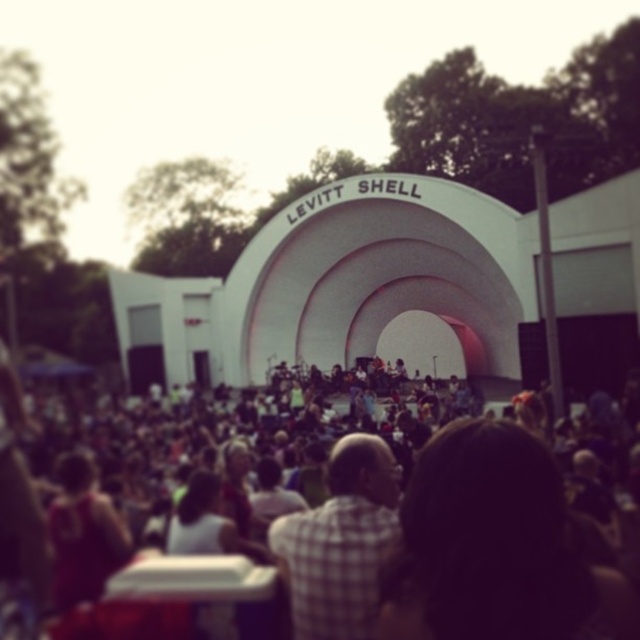
Is white smooth levitt shell at center smaller than checkered fabric shirt at center?

No, white smooth levitt shell at center is not smaller than checkered fabric shirt at center.

Which is below, white smooth levitt shell at center or checkered fabric shirt at center?

checkered fabric shirt at center is lower down.

Which is in front, point (333, 252) or point (339, 593)?

Point (339, 593) is in front.

Identify the location of white smooth levitt shell at center. (352, 291).

Is checkered fabric crowd at center thinner than white smooth levitt shell at center?

Indeed, checkered fabric crowd at center has a lesser width compared to white smooth levitt shell at center.

Can you confirm if checkered fabric crowd at center is bigger than white smooth levitt shell at center?

No.

Identify the location of checkered fabric crowd at center. (342, 540).

Locate an element on the screen. This screenshot has width=640, height=640. checkered fabric crowd at center is located at coordinates pos(342,540).

Between checkered fabric crowd at center and checkered fabric shirt at center, which one is positioned lower?

Positioned lower is checkered fabric shirt at center.

Locate an element on the screen. The image size is (640, 640). checkered fabric crowd at center is located at coordinates (342, 540).

Where is `checkered fabric crowd at center`? This screenshot has width=640, height=640. checkered fabric crowd at center is located at coordinates (342, 540).

Identify the location of checkered fabric crowd at center. The height and width of the screenshot is (640, 640). (342, 540).